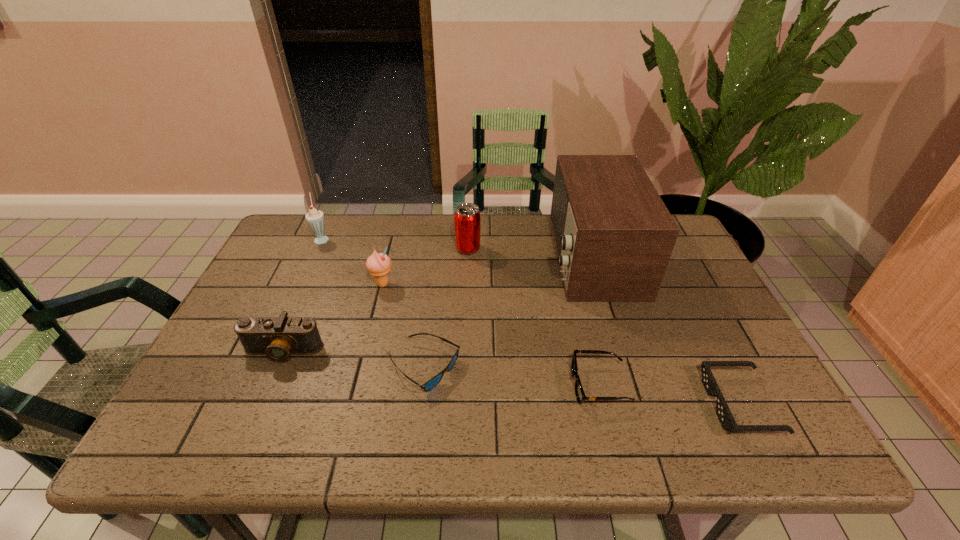
You are a GUI agent. You are given a task and a screenshot of the screen. Output one action in this format:
    pyautogui.click(x=<x>, y=<y>)
    Task: Click on the free point that satisfies the following two spatial constraints: 1. on the straw side of the milkshake; 2. on the right side of the soda can
    
    Given the screenshot: What is the action you would take?
    pyautogui.click(x=318, y=249)

Find the location of a particular element. This screenshot has height=540, width=960. vacant space that satisfies the following two spatial constraints: 1. on the front-facing side of the tallest object; 2. on the lens of the fourth shortest object is located at coordinates (621, 352).